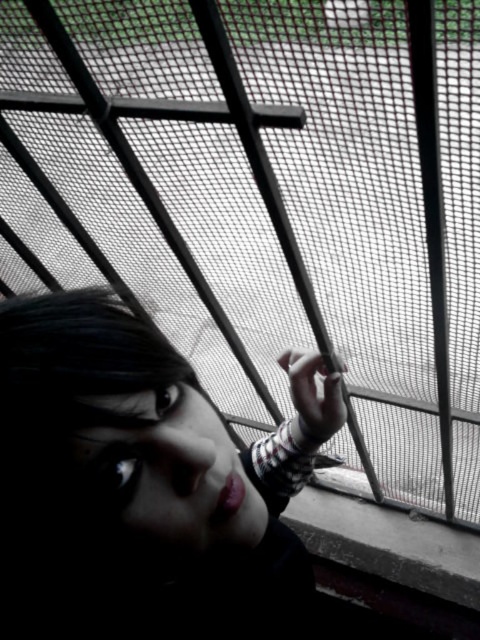
You are a photographer adjusting the focus on your camera. You want to capture both the matte black hair at center and the matte skin face at lower left in sharp focus. Which object should you focus on first to ensure both are in focus?

You should focus on the matte black hair at center first because it is closer to the viewer than the matte skin face at lower left. By focusing on the closer object, the farther object will also be in focus due to the depth of field.

You are a photographer standing at a distance of 45 centimeters from the subject. You notice the matte black hair at center in the image. Can you confirm if your current distance is sufficient to capture a clear closeup shot without overfilling the frame?

The matte black hair at center and viewer are 45.50 centimeters apart, so your current distance of 45 centimeters is slightly closer than the required distance. To avoid overfilling the frame, you should move back approximately 0.5 centimeters to match the specified distance.

You are using a camera to take a photo of the scene. The camera has a focus range of 50 to 60 centimeters. Is the point at coordinate point (211, 445) within the camera focus range?

The point at coordinate point (211, 445) is 53.13 centimeters from the camera, which falls within the focus range of 50 to 60 centimeters. Therefore, the point is within the camera focus range.